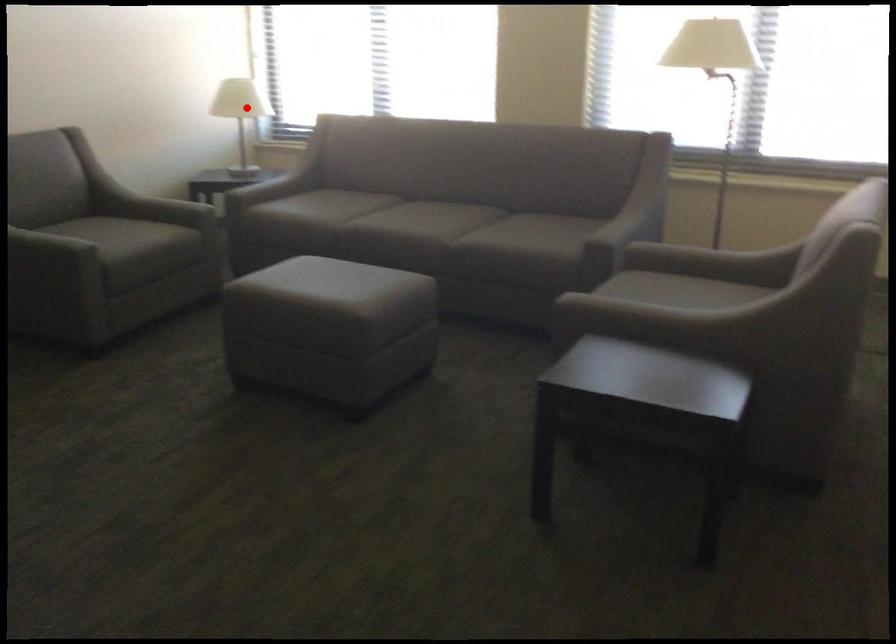
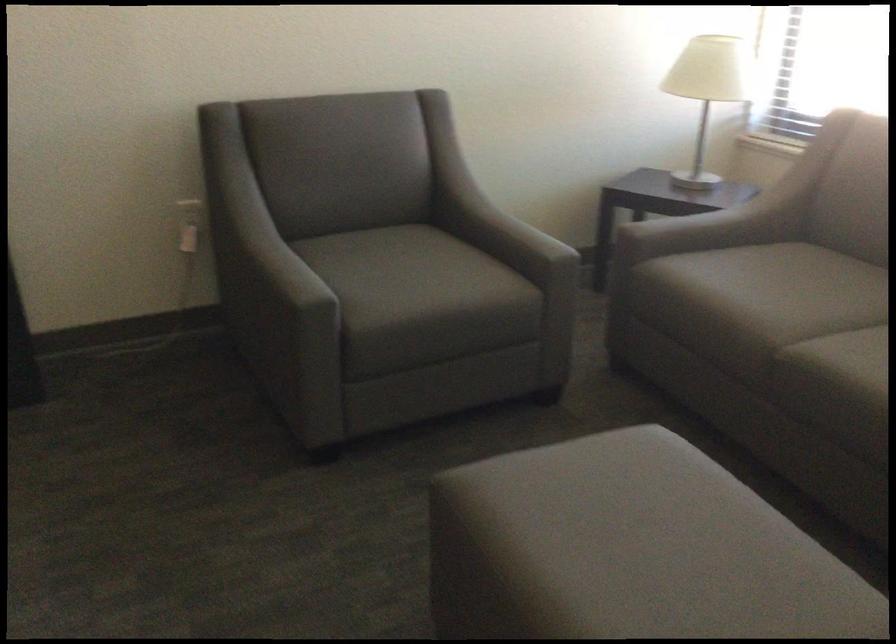
Question: I am providing you with two images of the same scene from different viewpoints. Image1 has a red point marked. In image2, the corresponding 3D location appears at what relative position? Reply with the corresponding letter.

Choices:
 (A) Closer
 (B) Farther

Answer: (A)